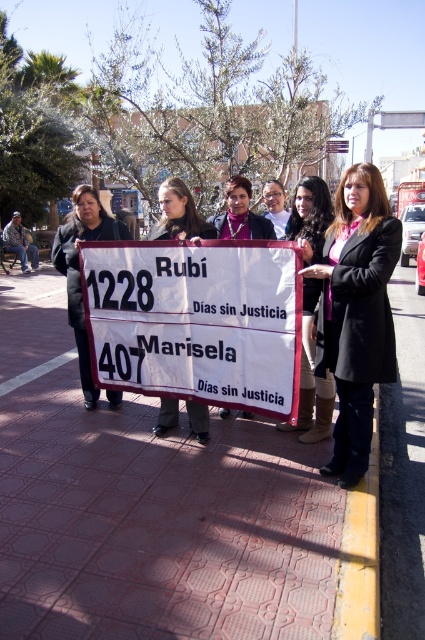
You are a photographer trying to capture a clear shot of the matte black coat at center without the red brick pavement at center obstructing the view. Is there a way to adjust your position to achieve this?

The red brick pavement at center is positioned on the right side of the matte black coat at center. To avoid obstruction, move to the left side of the matte black coat at center so that the red brick pavement at center is out of frame.

You are standing in the plaza where the protest is taking place. You see the red brick pavement at center and the matte black coat at center. Which object is closer to the ground?

The red brick pavement at center is located below the matte black coat at center, so the red brick pavement at center is closer to the ground.

Consider the image. You are a photographer trying to capture the entire scene in one shot. You notice the white paper sign at center and the yellow painted concrete at lower right. Which object should you focus on to ensure both are in frame without moving the camera?

You should focus on the white paper sign at center because it is wider than the yellow painted concrete at lower right, so centering on the sign will keep both objects within the frame.